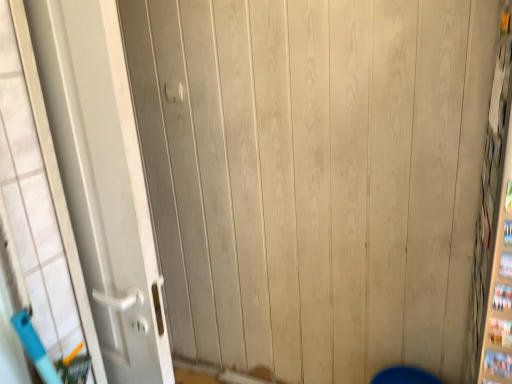
What do you see at coordinates (174, 92) in the screenshot? This screenshot has width=512, height=384. I see `white plastic door handle at upper center` at bounding box center [174, 92].

Image resolution: width=512 pixels, height=384 pixels. I want to click on white plastic door handle at upper center, so point(174,92).

Describe the element at coordinates (103, 181) in the screenshot. I see `white matte door at left` at that location.

Measure the distance between point (164,337) and camera.

The depth of point (164,337) is 3.46 feet.

Find the location of a particular element. This screenshot has width=512, height=384. white matte door at left is located at coordinates (103, 181).

Identify the location of white plastic door handle at upper center. (174, 92).

Is white matte door at left at the left side of white plastic door handle at upper center?

Indeed, white matte door at left is positioned on the left side of white plastic door handle at upper center.

Which object is further away from the camera, white matte door at left or white plastic door handle at upper center?

white plastic door handle at upper center is behind.

Considering the positions of point (75, 95) and point (181, 93), is point (75, 95) closer or farther from the camera than point (181, 93)?

Clearly, point (75, 95) is closer to the camera than point (181, 93).

From the picture: From the image's perspective, would you say white matte door at left is shown under white plastic door handle at upper center?

Yes, from the image's perspective, white matte door at left is beneath white plastic door handle at upper center.

From a real-world perspective, which is physically below, white matte door at left or white plastic door handle at upper center?

In real-world perspective, white matte door at left is lower.

Is white matte door at left thinner than white plastic door handle at upper center?

Incorrect, the width of white matte door at left is not less than that of white plastic door handle at upper center.

Can you confirm if white matte door at left is shorter than white plastic door handle at upper center?

In fact, white matte door at left may be taller than white plastic door handle at upper center.

In terms of size, does white matte door at left appear bigger or smaller than white plastic door handle at upper center?

In the image, white matte door at left appears to be larger than white plastic door handle at upper center.

Based on the photo, is white matte door at left outside of white plastic door handle at upper center?

white matte door at left lies outside white plastic door handle at upper center's area.

Are white matte door at left and white plastic door handle at upper center located far from each other?

No, there isn't a large distance between white matte door at left and white plastic door handle at upper center.

Is white matte door at left looking in the opposite direction of white plastic door handle at upper center?

No, white plastic door handle at upper center is not at the back of white matte door at left.

How many degrees apart are the facing directions of white matte door at left and white plastic door handle at upper center?

white matte door at left and white plastic door handle at upper center are facing 175 degrees away from each other.

In order to click on door that appears below the white plastic door handle at upper center (from the image's perspective) in this screenshot , I will do `click(103, 181)`.

Based on their positions, is white plastic door handle at upper center located to the left or right of white matte door at left?

white plastic door handle at upper center is to the right of white matte door at left.

In the image, is white plastic door handle at upper center positioned in front of or behind white matte door at left?

In the image, white plastic door handle at upper center appears behind white matte door at left.

Which is in front, point (170, 101) or point (80, 144)?

The point (80, 144) is more forward.

From the image's perspective, is white plastic door handle at upper center on white matte door at left?

Yes, from the image's perspective, white plastic door handle at upper center is on top of white matte door at left.

From a real-world perspective, is white plastic door handle at upper center below white matte door at left?

Incorrect, from a real-world perspective, white plastic door handle at upper center is higher than white matte door at left.

Between white plastic door handle at upper center and white matte door at left, which one has larger width?

Wider between the two is white matte door at left.

Which of these two, white plastic door handle at upper center or white matte door at left, stands taller?

With more height is white matte door at left.

Between white plastic door handle at upper center and white matte door at left, which one has larger size?

With larger size is white matte door at left.

Is white plastic door handle at upper center positioned beyond the bounds of white matte door at left?

Absolutely, white plastic door handle at upper center is external to white matte door at left.

Is white plastic door handle at upper center next to white matte door at left?

No, white plastic door handle at upper center is not touching white matte door at left.

Is white plastic door handle at upper center turned away from white matte door at left?

white plastic door handle at upper center does not have its back to white matte door at left.

At what (x,y) coordinates should I click in order to perform the action: click on door lying below the white plastic door handle at upper center (from the image's perspective). Please return your answer as a coordinate pair (x, y). The width and height of the screenshot is (512, 384). Looking at the image, I should click on (103, 181).

I want to click on door below the white plastic door handle at upper center (from a real-world perspective), so click(103, 181).

The width and height of the screenshot is (512, 384). Find the location of `door below the white plastic door handle at upper center (from the image's perspective)`. door below the white plastic door handle at upper center (from the image's perspective) is located at coordinates (103, 181).